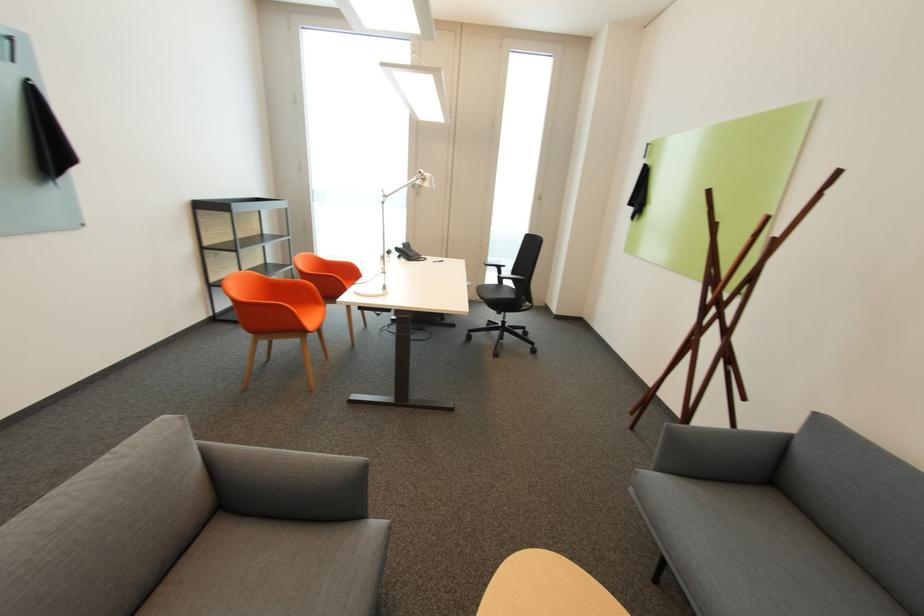
This screenshot has height=616, width=924. What are the coordinates of `white lamp head` in the screenshot? It's located at (419, 180).